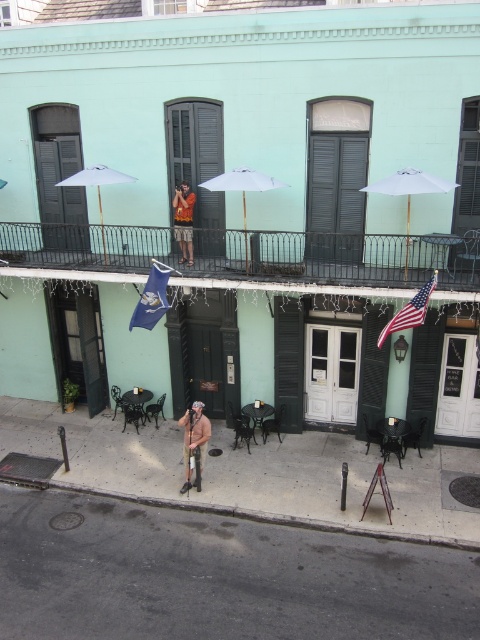
Question: Considering the relative positions of green matte shutter at upper center and white fabric umbrella at upper center in the image provided, where is green matte shutter at upper center located with respect to white fabric umbrella at upper center?

Choices:
 (A) above
 (B) below

Answer: (A)

Question: Which point is farther from the camera taking this photo?

Choices:
 (A) (167, 308)
 (B) (183, 220)

Answer: (B)

Question: Does dark gray wooden shutter at left come behind white fabric umbrella at center?

Choices:
 (A) yes
 (B) no

Answer: (A)

Question: Which of the following is the farthest from the observer?

Choices:
 (A) (219, 273)
 (B) (194, 449)
 (C) (211, 504)

Answer: (A)

Question: Which point is farther to the camera?

Choices:
 (A) smooth concrete sidewalk at lower center
 (B) american flag at center

Answer: (B)

Question: From the image, what is the correct spatial relationship of green matte shutter at upper center in relation to white fabric umbrella at center?

Choices:
 (A) left
 (B) right

Answer: (A)